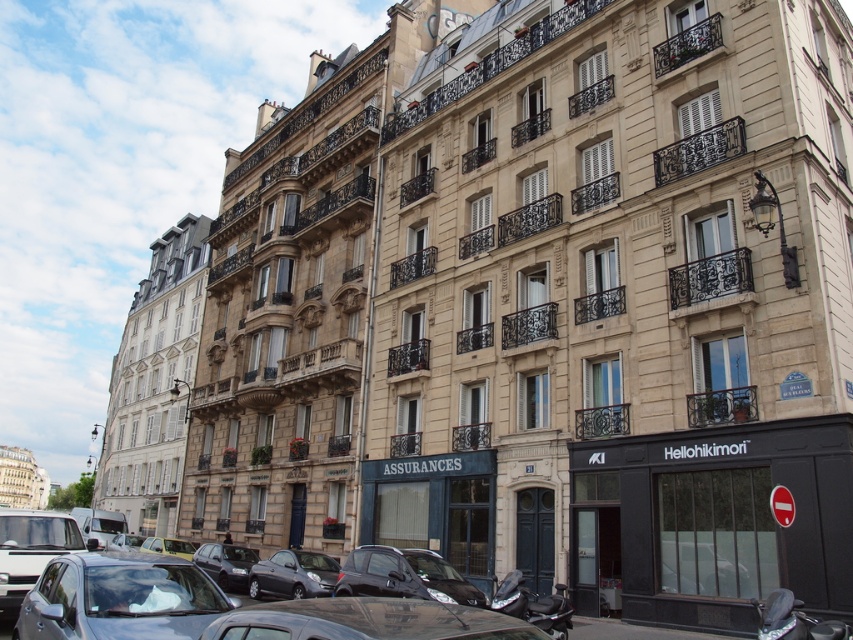
Does metallic gray car at lower left appear over shiny black sedan at center?

Indeed, metallic gray car at lower left is positioned over shiny black sedan at center.

Is point (165, 564) less distant than point (215, 548)?

Yes, point (165, 564) is in front of point (215, 548).

Where is `metallic gray car at lower left`? metallic gray car at lower left is located at coordinates (120, 598).

Which is behind, point (337, 620) or point (248, 573)?

The point (248, 573) is more distant.

Can you confirm if shiny black car at center is bigger than metallic gray hatchback at center?

Yes, shiny black car at center is bigger than metallic gray hatchback at center.

Between point (254, 609) and point (289, 589), which one is positioned in front?

Point (254, 609) is more forward.

The height and width of the screenshot is (640, 853). I want to click on shiny black car at center, so coord(120,600).

Can you confirm if shiny black car at center is taller than metallic gray car at lower left?

Correct, shiny black car at center is much taller as metallic gray car at lower left.

Is shiny black car at center thinner than metallic gray car at lower left?

No.

Who is more forward, (102, 579) or (106, 618)?

Point (106, 618) is in front.

This screenshot has height=640, width=853. I want to click on shiny black car at center, so click(120, 600).